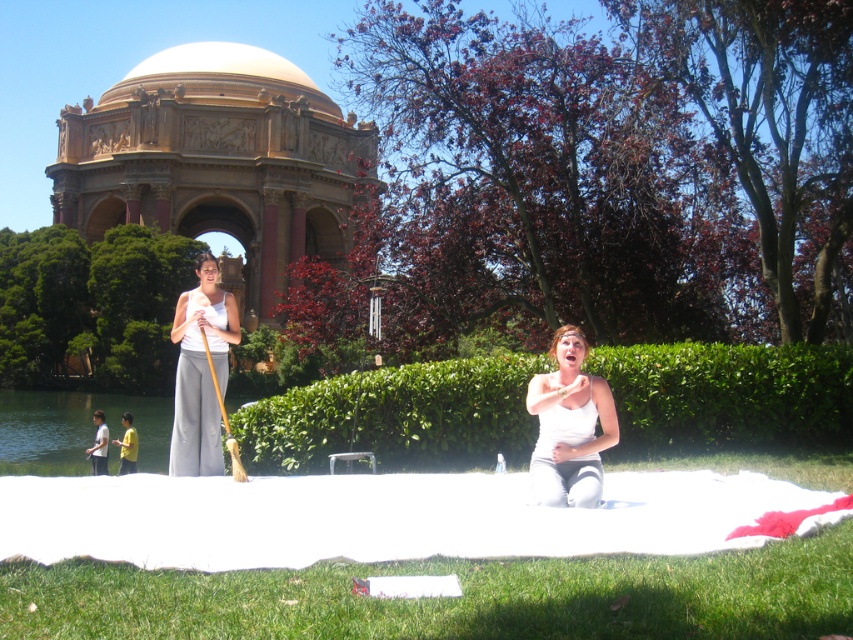
You are a GUI agent. You are given a task and a screenshot of the screen. Output one action in this format:
    pyautogui.click(x=<x>, y=<y>)
    Task: Click on the white cotton tank top at center
    This screenshot has height=640, width=853.
    Given the screenshot: What is the action you would take?
    pyautogui.click(x=200, y=371)

You are a GUI agent. You are given a task and a screenshot of the screen. Output one action in this format:
    pyautogui.click(x=<x>, y=<y>)
    Task: Click on the white cotton tank top at center
    The width and height of the screenshot is (853, 640).
    Given the screenshot: What is the action you would take?
    pyautogui.click(x=200, y=371)

Between white fabric blanket at lower center and yellow fabric at lower left, which one is positioned lower?

white fabric blanket at lower center is below.

Can you confirm if white fabric blanket at lower center is positioned above yellow fabric at lower left?

No, white fabric blanket at lower center is not above yellow fabric at lower left.

Where is `white fabric blanket at lower center`? white fabric blanket at lower center is located at coordinates (390, 516).

Which of these two, green grass at lower center or yellow fabric at lower left, stands taller?

Standing taller between the two is yellow fabric at lower left.

Locate an element on the screen. green grass at lower center is located at coordinates (453, 596).

Is point (676, 563) in front of point (126, 426)?

Yes, point (676, 563) is in front of point (126, 426).

Identify the location of green grass at lower center. (453, 596).